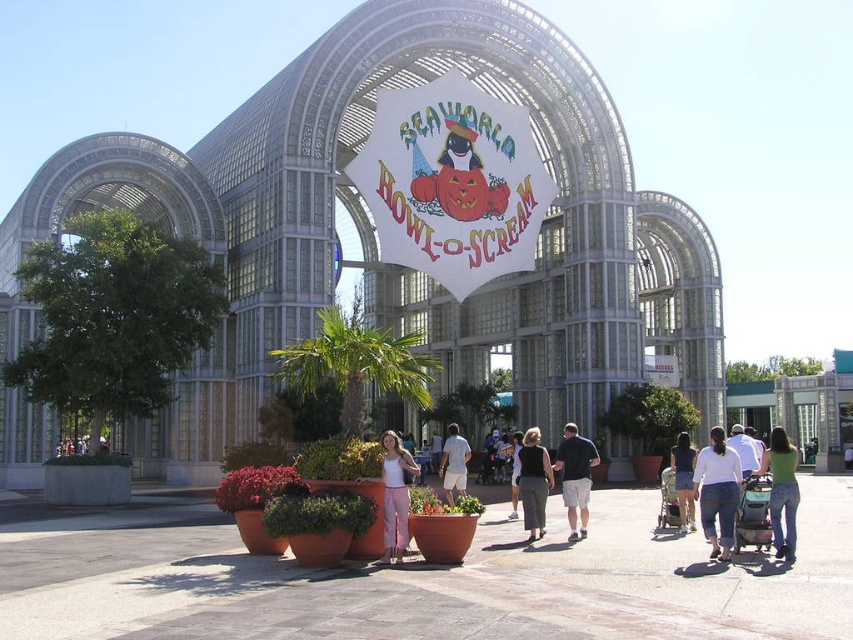
You are standing at the entrance of the theme park and want to reach the white cotton shirt at lower right. The white glass building at center is in your path. Can you walk around it to reach the shirt?

The white glass building at center is 39.23 meters away from the white cotton shirt at lower right. Since the building is a large structure, you can walk around it to reach the shirt.

You are standing in front of the modern architectural structure with the banner. You see two points marked as point 1 at coordinates (521, 458) and point 2 at coordinates (515, 499). Which point is closer to you?

Point 1 at coordinates (521, 458) is closer to you than point 2 at coordinates (515, 499).